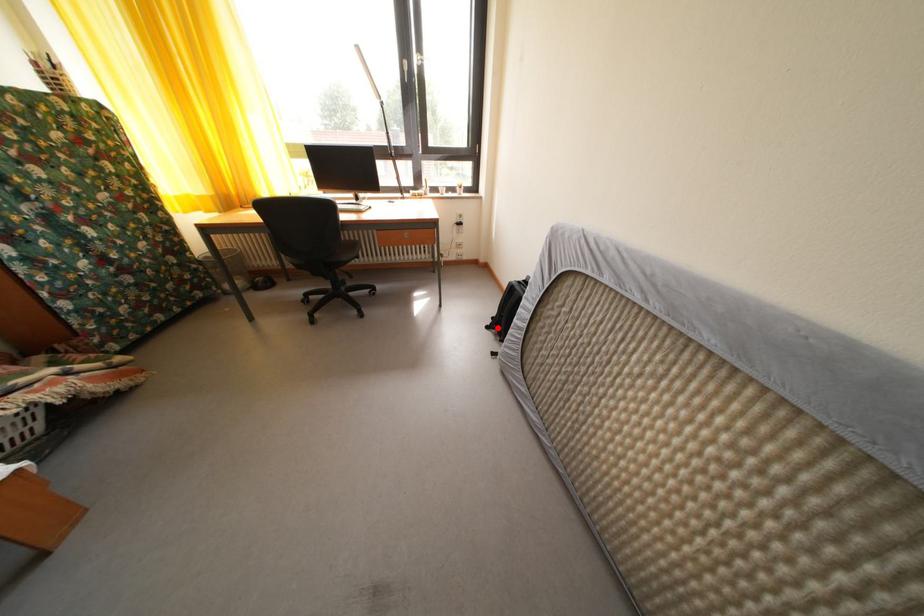
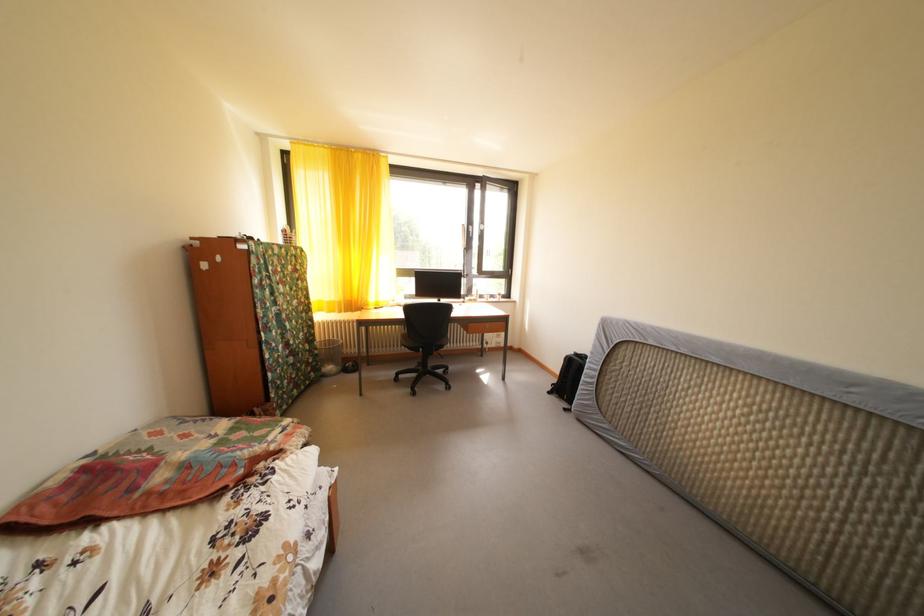
Question: I am providing you with two images of the same scene from different viewpoints. A red point is shown in image1. For the corresponding object point in image2, is it positioned nearer or farther from the camera?

Choices:
 (A) Nearer
 (B) Farther

Answer: (A)